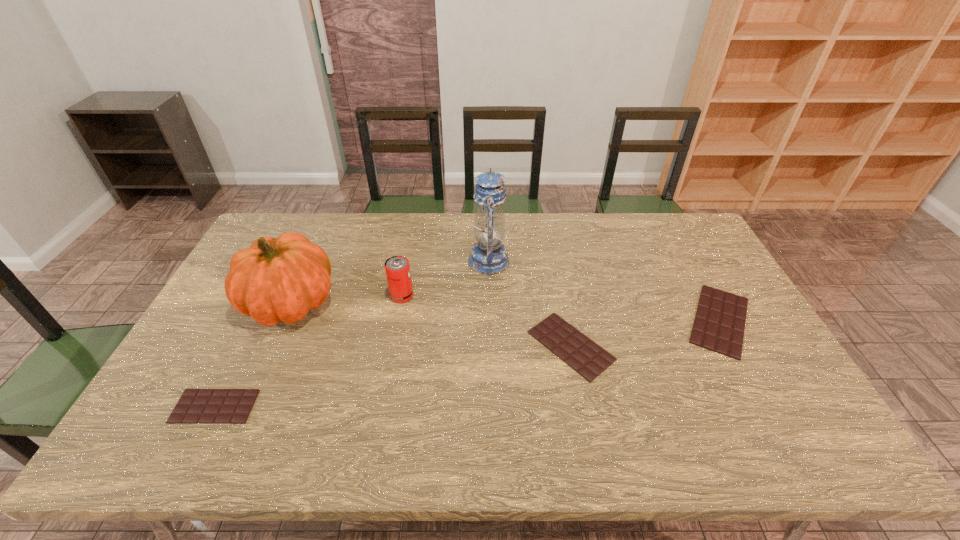
You are a GUI agent. You are given a task and a screenshot of the screen. Output one action in this format:
    pyautogui.click(x=<x>, y=<y>)
    Task: Click on the shortest object
    
    Given the screenshot: What is the action you would take?
    pyautogui.click(x=196, y=406)

Locate an element on the screen. This screenshot has height=540, width=960. the nearest object is located at coordinates (196, 406).

The height and width of the screenshot is (540, 960). I want to click on the second shortest object, so click(x=583, y=355).

Image resolution: width=960 pixels, height=540 pixels. I want to click on the second chocolate bar from left to right, so click(x=583, y=355).

Find the location of a particular element. The width and height of the screenshot is (960, 540). the rightmost chocolate bar is located at coordinates (719, 324).

You are a GUI agent. You are given a task and a screenshot of the screen. Output one action in this format:
    pyautogui.click(x=<x>, y=<y>)
    Task: Click on the third object from right to left
    The width and height of the screenshot is (960, 540).
    Given the screenshot: What is the action you would take?
    pyautogui.click(x=488, y=257)

Find the location of `lantern`. lantern is located at coordinates (488, 257).

Find the location of a particular element. This screenshot has height=540, width=960. can is located at coordinates (397, 268).

The width and height of the screenshot is (960, 540). In order to click on the third tallest object in this screenshot , I will do `click(397, 268)`.

In order to click on the second tallest object in this screenshot , I will do `click(279, 279)`.